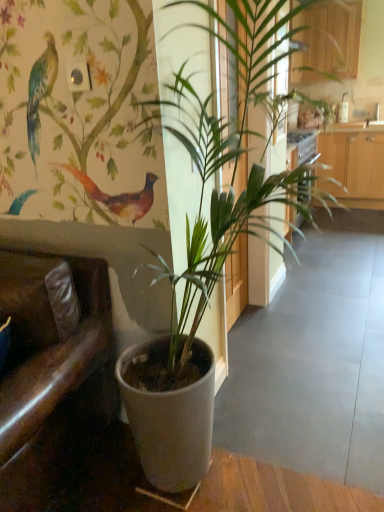
Question: Is wooden cabinet at upper right far away from green matte plant at center?

Choices:
 (A) no
 (B) yes

Answer: (A)

Question: Is wooden cabinet at upper right facing away from green matte plant at center?

Choices:
 (A) yes
 (B) no

Answer: (B)

Question: Is wooden cabinet at upper right closer to camera compared to green matte plant at center?

Choices:
 (A) no
 (B) yes

Answer: (A)

Question: Considering the relative positions of wooden cabinet at upper right and green matte plant at center in the image provided, is wooden cabinet at upper right to the left of green matte plant at center from the viewer's perspective?

Choices:
 (A) no
 (B) yes

Answer: (A)

Question: Considering the relative sizes of wooden cabinet at upper right and green matte plant at center in the image provided, is wooden cabinet at upper right thinner than green matte plant at center?

Choices:
 (A) no
 (B) yes

Answer: (B)

Question: Can you confirm if wooden cabinet at upper right is smaller than green matte plant at center?

Choices:
 (A) yes
 (B) no

Answer: (A)

Question: Is brown leather armchair at left bigger than green matte plant at center?

Choices:
 (A) no
 (B) yes

Answer: (A)

Question: From a real-world perspective, is brown leather armchair at left located beneath green matte plant at center?

Choices:
 (A) no
 (B) yes

Answer: (B)

Question: Is brown leather armchair at left positioned with its back to green matte plant at center?

Choices:
 (A) no
 (B) yes

Answer: (A)

Question: Are brown leather armchair at left and green matte plant at center making contact?

Choices:
 (A) yes
 (B) no

Answer: (B)

Question: Is brown leather armchair at left facing towards green matte plant at center?

Choices:
 (A) yes
 (B) no

Answer: (B)

Question: Is brown leather armchair at left far away from green matte plant at center?

Choices:
 (A) yes
 (B) no

Answer: (B)

Question: Considering the relative positions of brown leather armchair at left and wooden cabinet at upper right in the image provided, is brown leather armchair at left behind wooden cabinet at upper right?

Choices:
 (A) no
 (B) yes

Answer: (A)